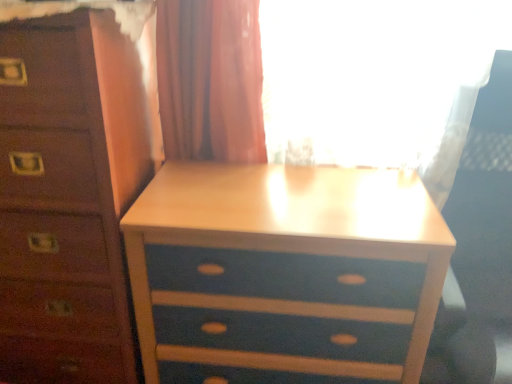
Question: Does blue painted wood nightstand at center come behind white plastic swivel chair at right?

Choices:
 (A) no
 (B) yes

Answer: (B)

Question: Is blue painted wood nightstand at center outside of white plastic swivel chair at right?

Choices:
 (A) no
 (B) yes

Answer: (B)

Question: Considering the relative sizes of blue painted wood nightstand at center and white plastic swivel chair at right in the image provided, is blue painted wood nightstand at center bigger than white plastic swivel chair at right?

Choices:
 (A) yes
 (B) no

Answer: (B)

Question: From a real-world perspective, is blue painted wood nightstand at center on top of white plastic swivel chair at right?

Choices:
 (A) yes
 (B) no

Answer: (B)

Question: Is blue painted wood nightstand at center next to white plastic swivel chair at right?

Choices:
 (A) yes
 (B) no

Answer: (B)

Question: In terms of width, does blue painted wood chest of drawers at center look wider or thinner when compared to blue painted wood nightstand at center?

Choices:
 (A) thin
 (B) wide

Answer: (B)

Question: From a real-world perspective, is blue painted wood chest of drawers at center physically located above or below blue painted wood nightstand at center?

Choices:
 (A) above
 (B) below

Answer: (A)

Question: Considering the positions of point (114, 29) and point (293, 213), is point (114, 29) closer or farther from the camera than point (293, 213)?

Choices:
 (A) farther
 (B) closer

Answer: (B)

Question: Is blue painted wood chest of drawers at center in front of or behind blue painted wood nightstand at center in the image?

Choices:
 (A) behind
 (B) front

Answer: (B)

Question: From the image's perspective, is blue painted wood chest of drawers at center located above or below white plastic swivel chair at right?

Choices:
 (A) above
 (B) below

Answer: (A)

Question: Considering the positions of blue painted wood chest of drawers at center and white plastic swivel chair at right in the image, is blue painted wood chest of drawers at center wider or thinner than white plastic swivel chair at right?

Choices:
 (A) wide
 (B) thin

Answer: (B)

Question: From their relative heights in the image, would you say blue painted wood chest of drawers at center is taller or shorter than white plastic swivel chair at right?

Choices:
 (A) short
 (B) tall

Answer: (B)

Question: Considering the relative positions of blue painted wood chest of drawers at center and white plastic swivel chair at right in the image provided, is blue painted wood chest of drawers at center to the left or to the right of white plastic swivel chair at right?

Choices:
 (A) right
 (B) left

Answer: (B)

Question: In the image, is white plastic swivel chair at right positioned in front of or behind blue painted wood nightstand at center?

Choices:
 (A) behind
 (B) front

Answer: (B)

Question: From their relative heights in the image, would you say white plastic swivel chair at right is taller or shorter than blue painted wood nightstand at center?

Choices:
 (A) short
 (B) tall

Answer: (B)